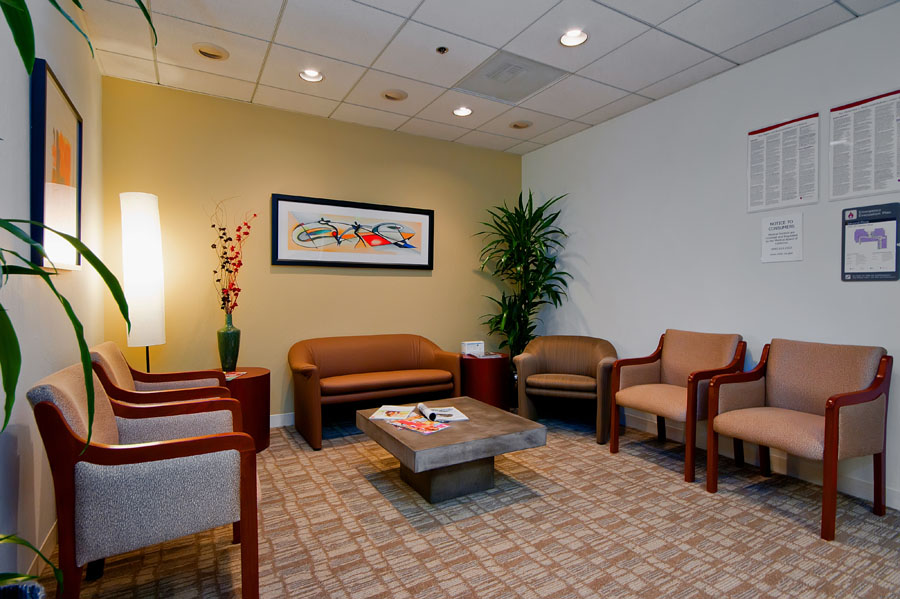
The width and height of the screenshot is (900, 599). I want to click on lamp, so click(x=140, y=281).